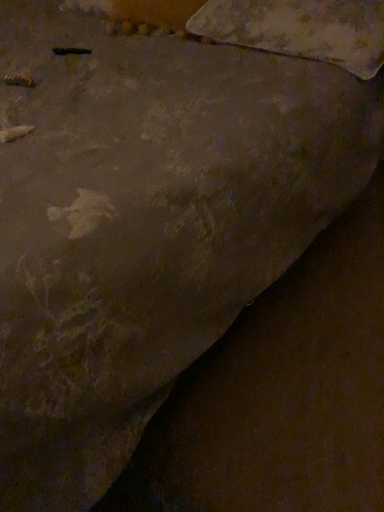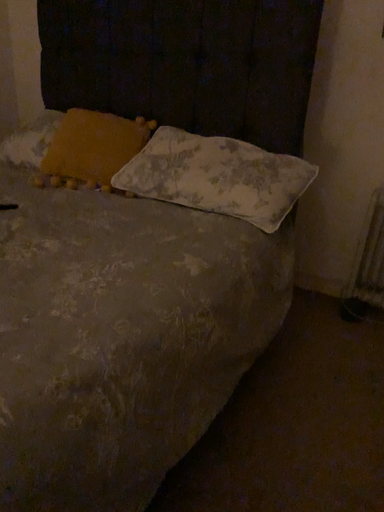
Question: How did the camera likely rotate when shooting the video?

Choices:
 (A) rotated upward
 (B) rotated downward

Answer: (A)